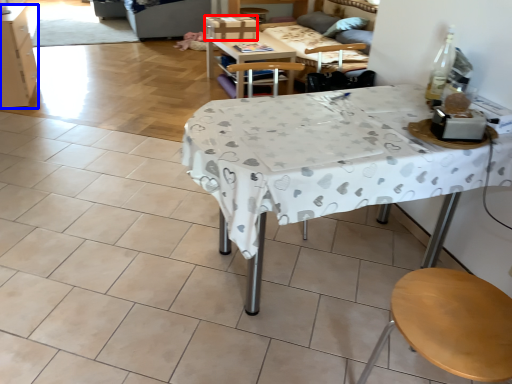
Question: Which point is further to the camera, box (highlighted by a red box) or cabinetry (highlighted by a blue box)?

Choices:
 (A) box
 (B) cabinetry

Answer: (A)